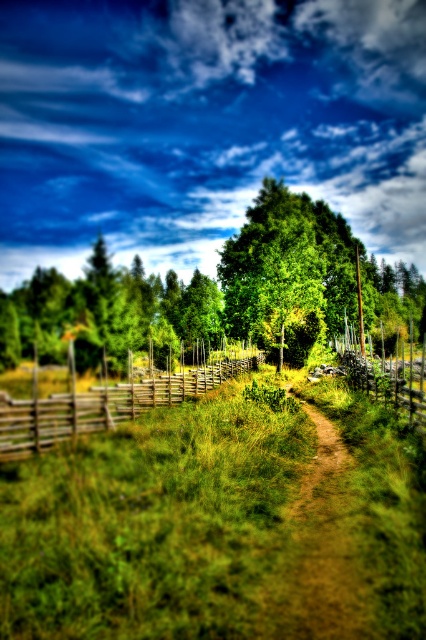
Question: Is green grass at center further to camera compared to green leafy tree at center?

Choices:
 (A) no
 (B) yes

Answer: (A)

Question: Is green grass at center bigger than wooden at center-right?

Choices:
 (A) yes
 (B) no

Answer: (B)

Question: Is green grass at center bigger than green leafy tree at center?

Choices:
 (A) yes
 (B) no

Answer: (B)

Question: Among these objects, which one is nearest to the camera?

Choices:
 (A) green grass at center
 (B) wooden at center-right

Answer: (A)

Question: Which point is farther to the camera?

Choices:
 (A) (344, 531)
 (B) (129, 394)
 (C) (290, 237)
 (D) (337, 502)

Answer: (C)

Question: Which point is closer to the camera?

Choices:
 (A) (371, 605)
 (B) (399, 401)
 (C) (86, 440)
 (D) (212, 371)

Answer: (A)